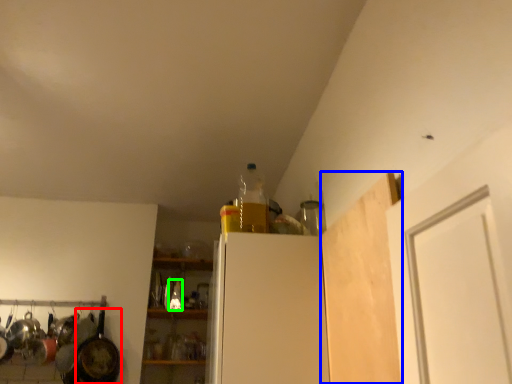
Question: Based on their relative distances, which object is nearer to frying pan (highlighted by a red box)? Choose from plywood (highlighted by a blue box) and bottle (highlighted by a green box).

Choices:
 (A) plywood
 (B) bottle

Answer: (B)